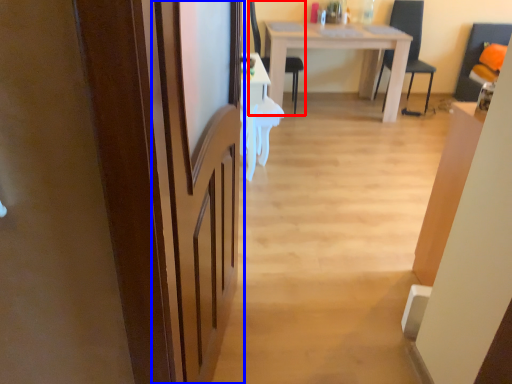
Question: Which object appears closest to the camera in this image, chair (highlighted by a red box) or screen door (highlighted by a blue box)?

Choices:
 (A) chair
 (B) screen door

Answer: (B)